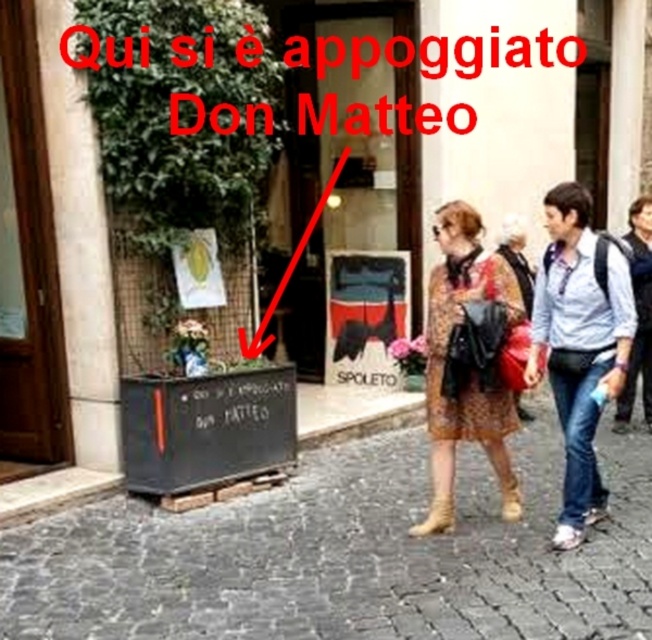
You are a tourist in Spoleto and you see a woman wearing a patterned fabric dress at center and a brown suede boot at lower center. Which item is closer to you?

The patterned fabric dress at center is positioned over the brown suede boot at lower center, so the dress is closer to you.

You are standing on the cobblestone street in front of the black planter box with the green ivy. There are two points marked on the ground in front of you. The first point is at coordinates point (623,429) and the second point is at point (501,477). Which point is closer to you?

The point at (623,429) is closer to you because it is further to the viewer than the other point at (501,477).